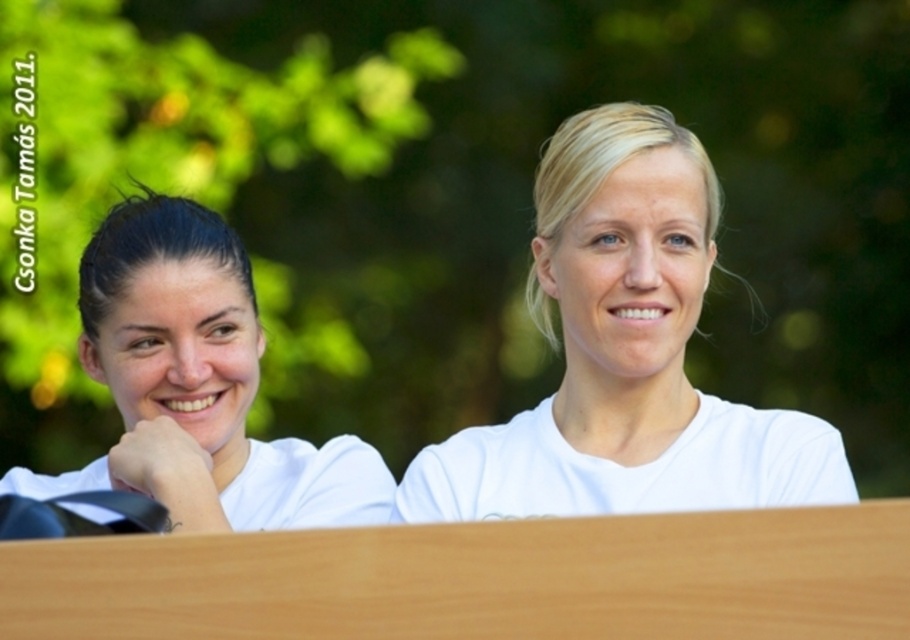
Which is more to the right, white matte shirt at center or white matte shirt at left?

white matte shirt at center is more to the right.

Between white matte shirt at center and white matte shirt at left, which one is positioned lower?

white matte shirt at left is below.

This screenshot has height=640, width=910. What do you see at coordinates (624, 353) in the screenshot?
I see `white matte shirt at center` at bounding box center [624, 353].

Find the location of `white matte shirt at center`. white matte shirt at center is located at coordinates (624, 353).